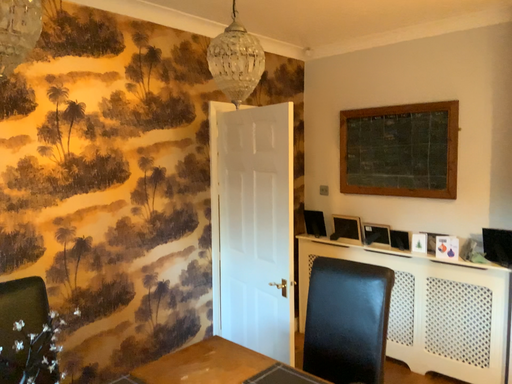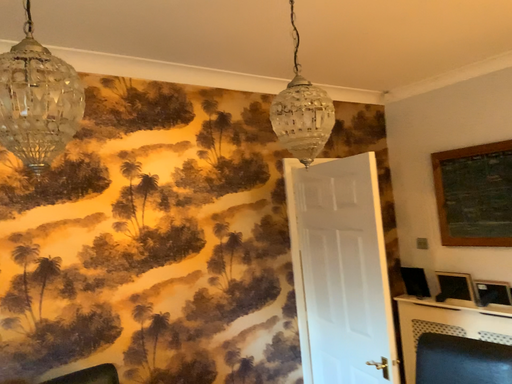
Question: How did the camera likely rotate when shooting the video?

Choices:
 (A) rotated downward
 (B) rotated upward

Answer: (B)